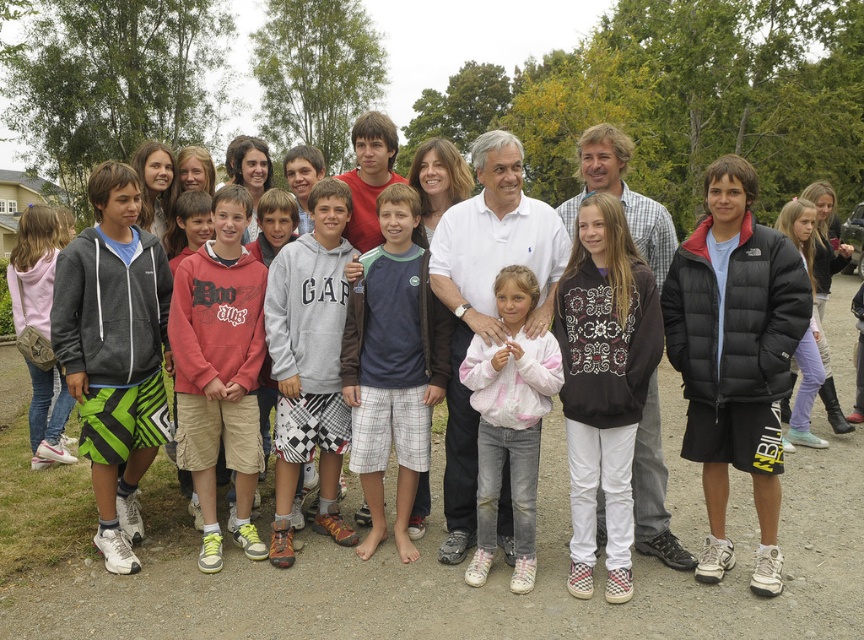
Question: Does dark blue cotton shirt at center have a larger size compared to white cotton shirt at center?

Choices:
 (A) no
 (B) yes

Answer: (A)

Question: Which point is closer to the camera?

Choices:
 (A) dark blue cotton shirt at center
 (B) white cotton jacket at center

Answer: (B)

Question: Is dark blue cotton shirt at center smaller than white cotton shirt at center?

Choices:
 (A) no
 (B) yes

Answer: (B)

Question: Does green and black shorts at left appear over white cotton shirt at center?

Choices:
 (A) no
 (B) yes

Answer: (A)

Question: Which point is closer to the camera?

Choices:
 (A) (723, 243)
 (B) (181, 433)

Answer: (A)

Question: Which of the following is the farthest from the observer?

Choices:
 (A) green and black shorts at left
 (B) gray cotton hoodie at center
 (C) dark blue cotton shirt at center
 (D) white cotton polo shirt at center

Answer: (C)